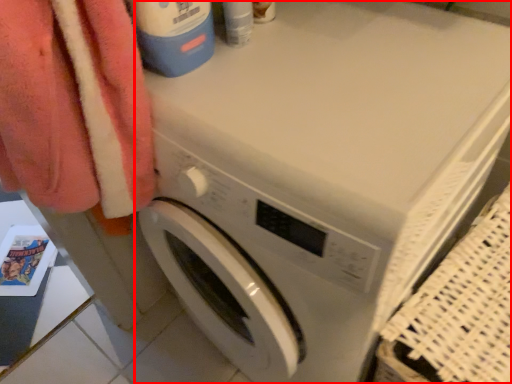
Question: From the image's perspective, what is the correct spatial positioning of washing machine (annotated by the red box) in reference to cleaning product?

Choices:
 (A) below
 (B) above

Answer: (A)